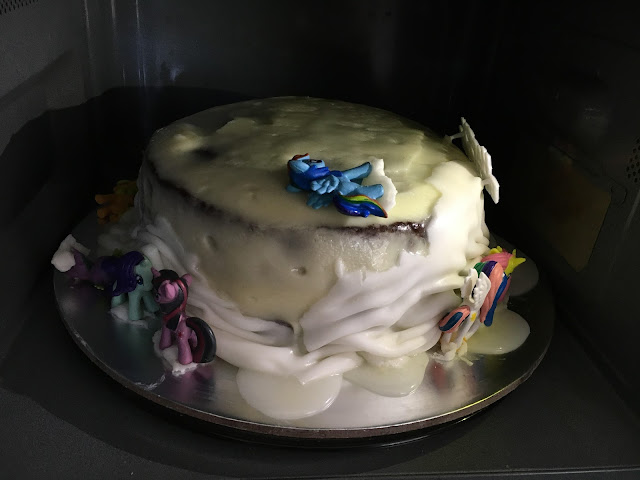
This screenshot has width=640, height=480. In order to click on table in this screenshot , I will do `click(36, 406)`.